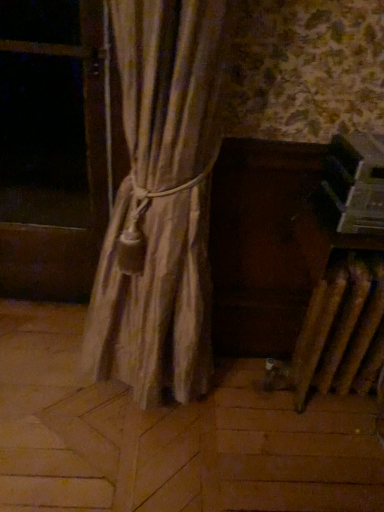
Question: Looking at their shapes, would you say transparent plastic window screen at left is wider or thinner than textured beige curtain at center?

Choices:
 (A) wide
 (B) thin

Answer: (B)

Question: Is point (61, 187) positioned closer to the camera than point (122, 245)?

Choices:
 (A) farther
 (B) closer

Answer: (A)

Question: Considering their positions, is transparent plastic window screen at left located in front of or behind textured beige curtain at center?

Choices:
 (A) behind
 (B) front

Answer: (A)

Question: Considering the positions of point (198, 68) and point (72, 195), is point (198, 68) closer or farther from the camera than point (72, 195)?

Choices:
 (A) farther
 (B) closer

Answer: (B)

Question: Would you say textured beige curtain at center is to the left or to the right of transparent plastic window screen at left in the picture?

Choices:
 (A) right
 (B) left

Answer: (A)

Question: Is textured beige curtain at center wider or thinner than transparent plastic window screen at left?

Choices:
 (A) wide
 (B) thin

Answer: (A)

Question: Considering the positions of textured beige curtain at center and transparent plastic window screen at left in the image, is textured beige curtain at center taller or shorter than transparent plastic window screen at left?

Choices:
 (A) tall
 (B) short

Answer: (A)